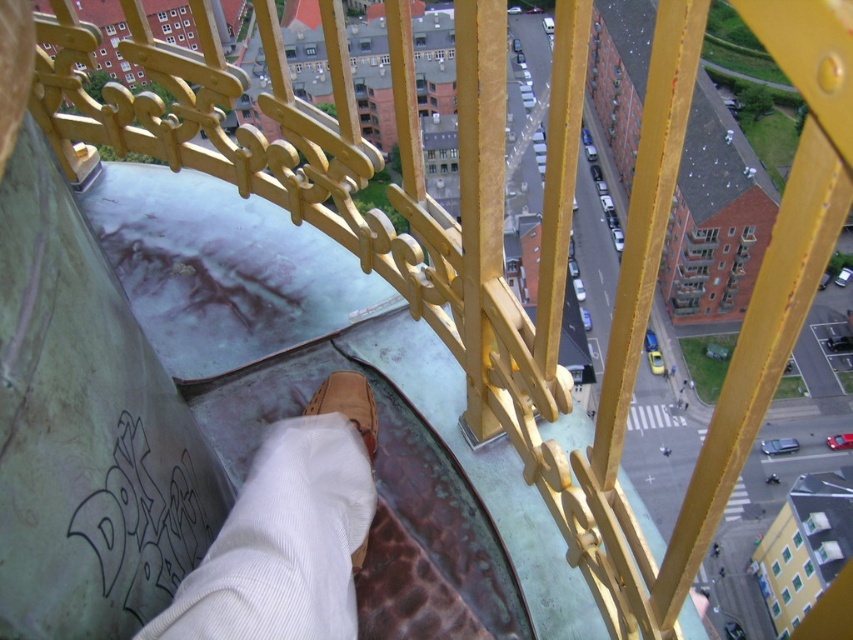
You are standing at the tower and looking down. You see two points marked on the city below. The first point is at coordinates point (227, 531) and the second is at point (320, 397). Which point is closer to you, the observer?

Point (227, 531) is in front of point (320, 397), so it is closer to you.